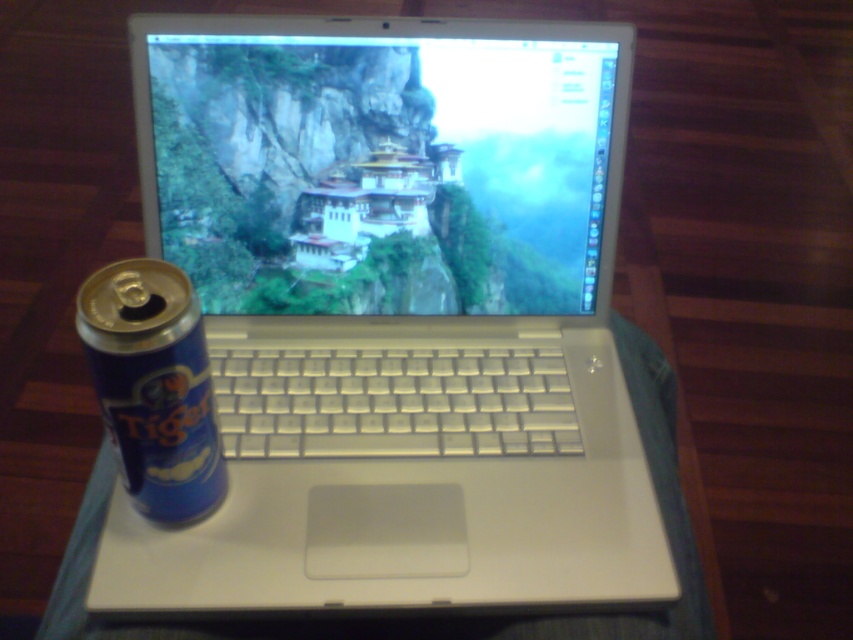
You are organizing items on a narrow shelf that can only accommodate one item at a time. You have a white plastic laptop at center and a blue metallic can at left. Which item should you place first if you want to ensure both items can fit on the shelf without overlapping?

The blue metallic can at left should be placed first because the white plastic laptop at center might be wider than blue metallic can at left, so placing the narrower item first allows adjusting space for the wider one later.

You are organizing items on a desk and notice the white plastic laptop at center and the metallic silver laptop at center. Which one is positioned higher on the desk?

The metallic silver laptop at center is positioned higher than the white plastic laptop at center because the white plastic laptop at center is located below it.